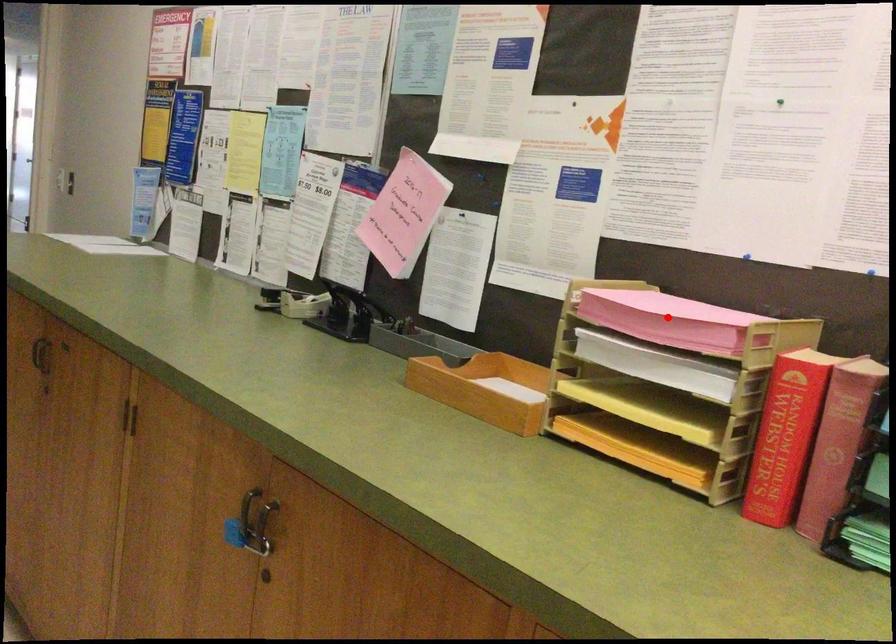
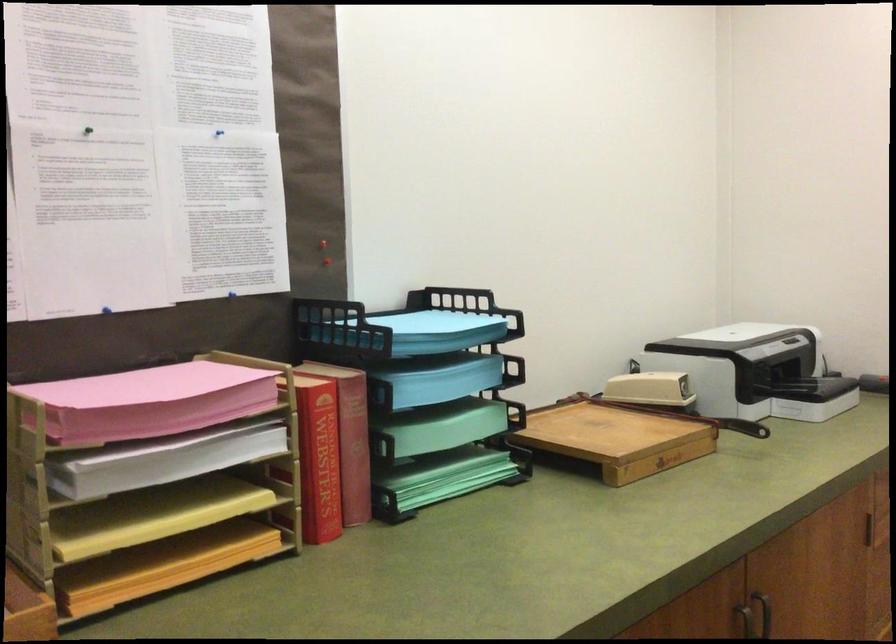
Question: A red point is marked in image1. In image2, is the corresponding 3D point closer to the camera or farther? Reply with the corresponding letter.

Choices:
 (A) The corresponding 3D point is closer.
 (B) The corresponding 3D point is farther.

Answer: (A)